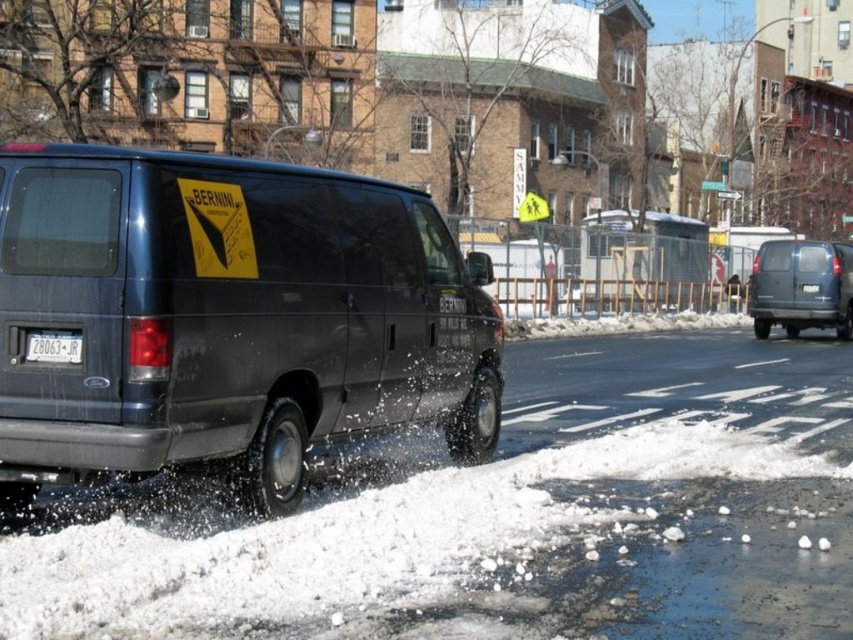
Question: Which of the following is the farthest from the observer?

Choices:
 (A) (799, 246)
 (B) (74, 339)

Answer: (A)

Question: Is matte black van at left to the right of matte gray minivan at right from the viewer's perspective?

Choices:
 (A) no
 (B) yes

Answer: (A)

Question: Among these objects, which one is farthest from the camera?

Choices:
 (A) matte gray minivan at right
 (B) white plastic license plate at lower left

Answer: (A)

Question: Is matte black van at left closer to the viewer compared to matte gray minivan at right?

Choices:
 (A) no
 (B) yes

Answer: (B)

Question: Which of these objects is positioned farthest from the matte black van at left?

Choices:
 (A) matte gray minivan at right
 (B) white plastic license plate at lower left

Answer: (A)

Question: Does matte gray minivan at right appear under white plastic license plate at lower left?

Choices:
 (A) no
 (B) yes

Answer: (A)